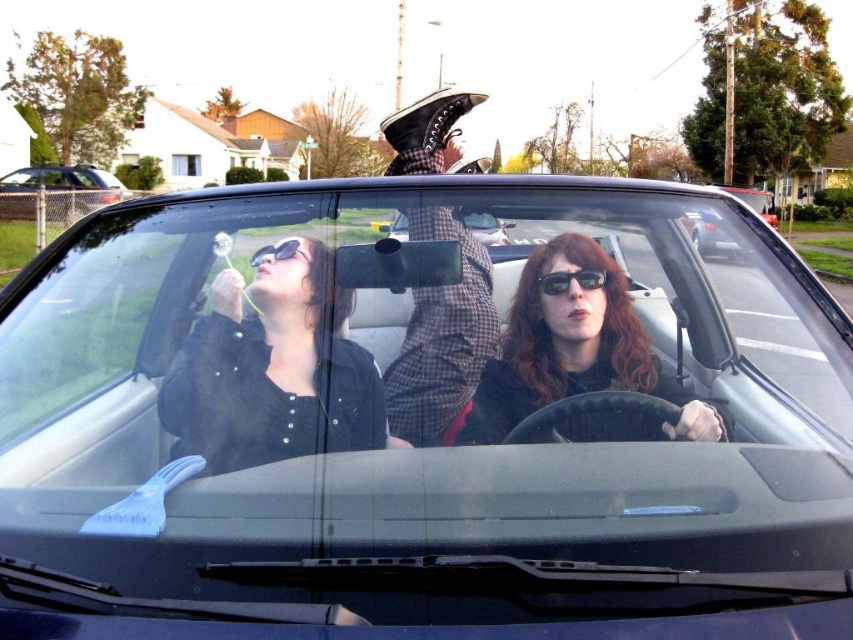
You are sitting in the back seat of the convertible and want to hand a book to the passenger. The passenger is sitting in the front passenger seat. Which object is closer to you, the checkered fabric shirt at center or the black leather car at center?

The checkered fabric shirt at center is closer to you because it is to the left of the black leather car at center, which would place it nearer in the seating arrangement.

You are a photographer holding a camera. You want to take a photo of the black leather convertible at center from a close distance. Can you position yourself within 1 meter of the convertible to take the shot?

The distance between the black leather convertible at center and the camera is 1.28 meters, so yes, you can position yourself within 1 meter of the black leather convertible at center to take the shot since the existing distance is greater than 1 meter.

You are a passenger in the convertible car and want to place both pairs of sunglasses on the dashboard. However, the dashboard has a limited width. Based on their positions in the image, which pair of sunglasses, the matte black sunglasses at center or the sunglassesmatte black at upper center, is wider and would require more space on the dashboard?

The matte black sunglasses at center is wider than the sunglassesmatte black at upper center, so it would require more space on the dashboard.